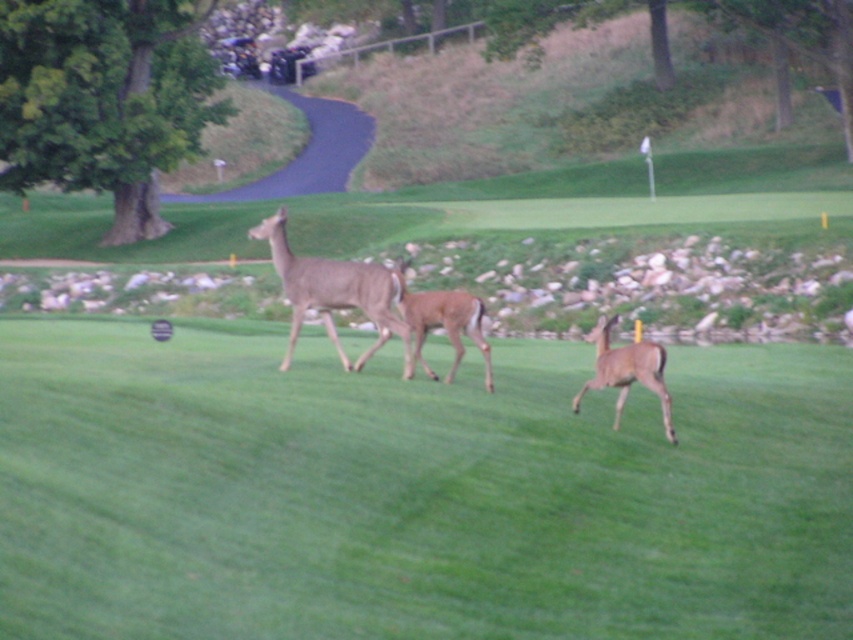
Question: Observing the image, what is the correct spatial positioning of green grass at center in reference to brown matte deer at center?

Choices:
 (A) left
 (B) right

Answer: (A)

Question: Which object appears farthest from the camera in this image?

Choices:
 (A) brown fur deer at center
 (B) brown matte/deer at center
 (C) brown matte deer at center
 (D) green grass at center

Answer: (A)

Question: Can you confirm if green grass at center is positioned below brown fur deer at center?

Choices:
 (A) no
 (B) yes

Answer: (B)

Question: Which point is closer to the camera taking this photo?

Choices:
 (A) (398, 316)
 (B) (654, 384)

Answer: (B)

Question: Which point appears closest to the camera in this image?

Choices:
 (A) tap(450, 307)
 (B) tap(405, 348)
 (C) tap(651, 364)

Answer: (C)

Question: From the image, what is the correct spatial relationship of brown fur deer at center in relation to brown matte deer at center?

Choices:
 (A) above
 (B) below

Answer: (A)